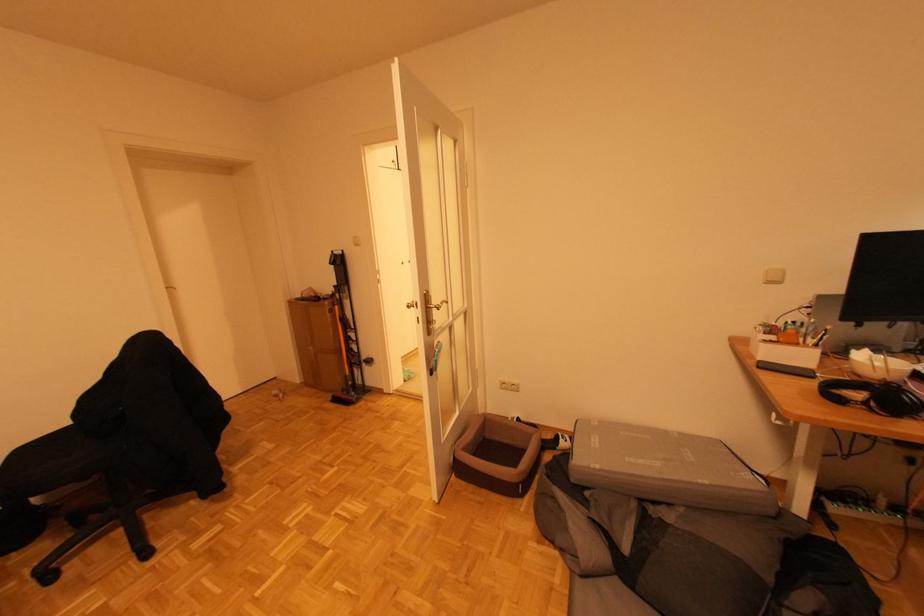
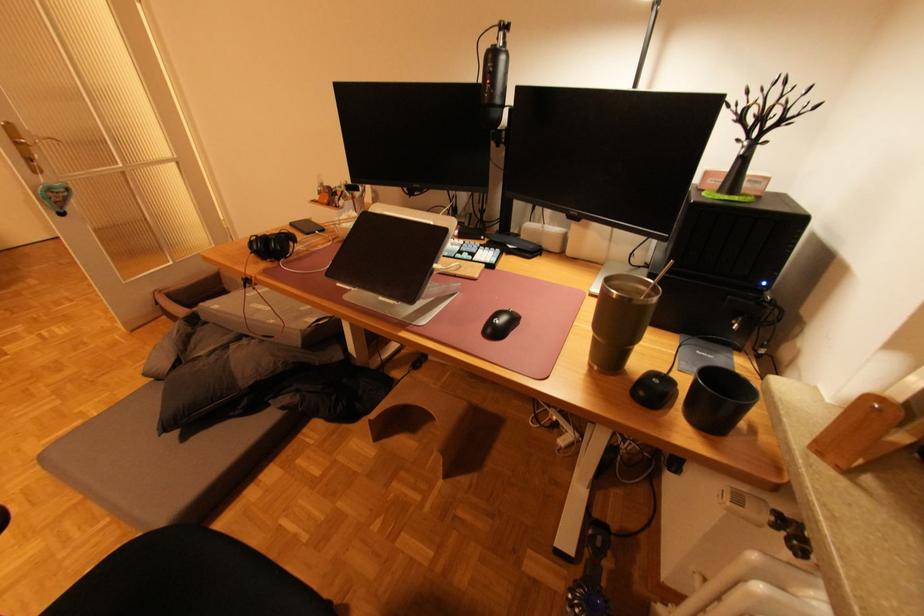
Question: Which direction would the cameraman need to move to produce the second image? Reply with the corresponding letter.

Choices:
 (A) Left
 (B) Right
 (C) Forward
 (D) Backward

Answer: (B)